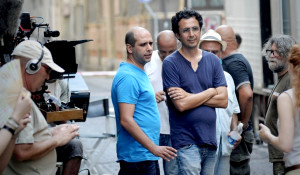
Identify the location of black av equipment. (65, 52).